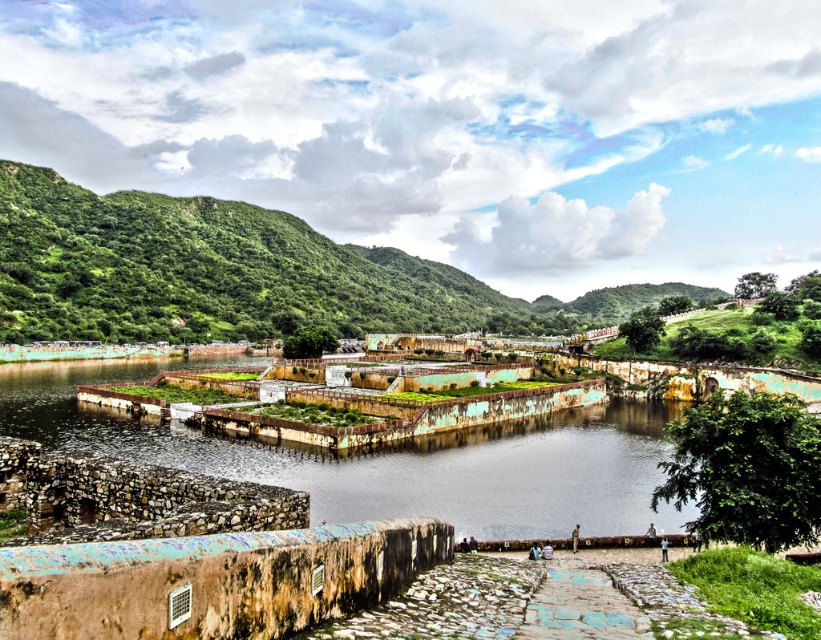
Who is positioned more to the left, green leafy hillside at upper left or brown stone river at center?

brown stone river at center is more to the left.

Is green leafy hillside at upper left closer to camera compared to brown stone river at center?

No, green leafy hillside at upper left is further to the viewer.

You are a GUI agent. You are given a task and a screenshot of the screen. Output one action in this format:
    pyautogui.click(x=<x>, y=<y>)
    Task: Click on the green leafy hillside at upper left
    The height and width of the screenshot is (640, 821).
    Given the screenshot: What is the action you would take?
    pyautogui.click(x=237, y=275)